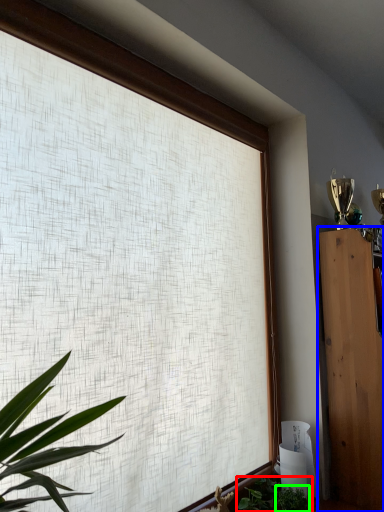
Question: Considering the real-world distances, which object is closest to houseplant (highlighted by a red box)? furniture (highlighted by a blue box) or plant (highlighted by a green box).

Choices:
 (A) furniture
 (B) plant

Answer: (B)